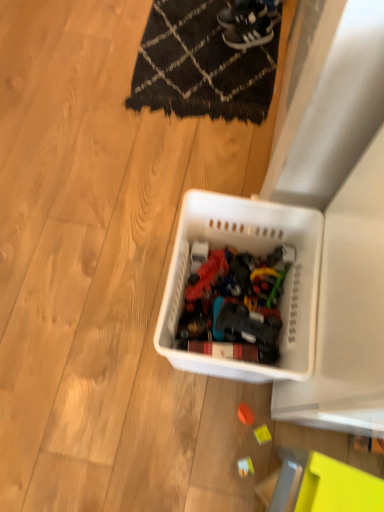
The image size is (384, 512). What are the coordinates of `free space to the left of white plastic basket at center` in the screenshot? It's located at (117, 318).